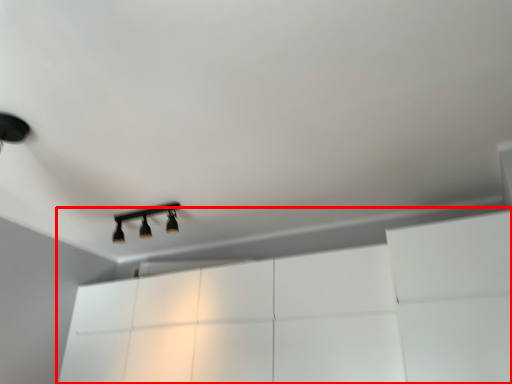
Question: Where is dresser (annotated by the red box) located in relation to lamp in the image?

Choices:
 (A) left
 (B) right

Answer: (B)